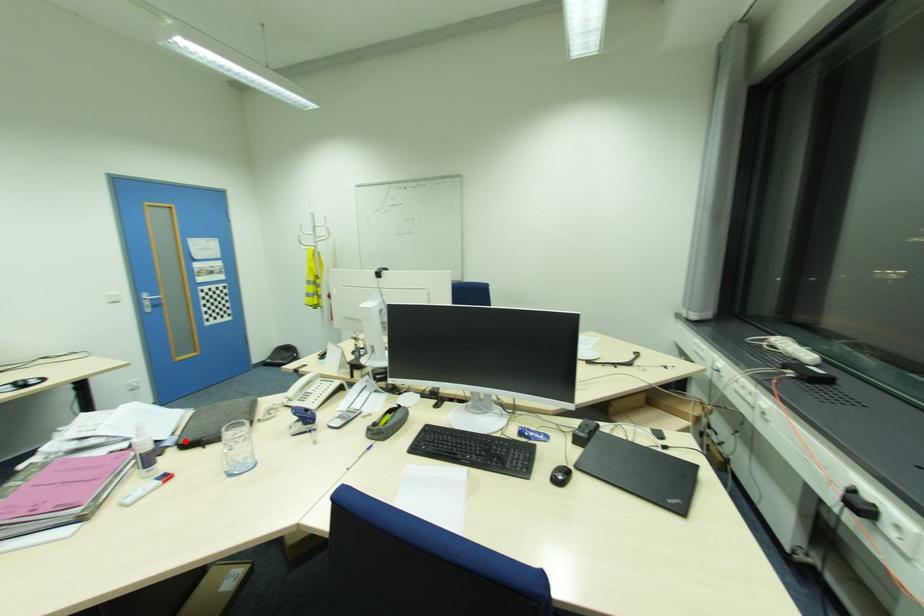
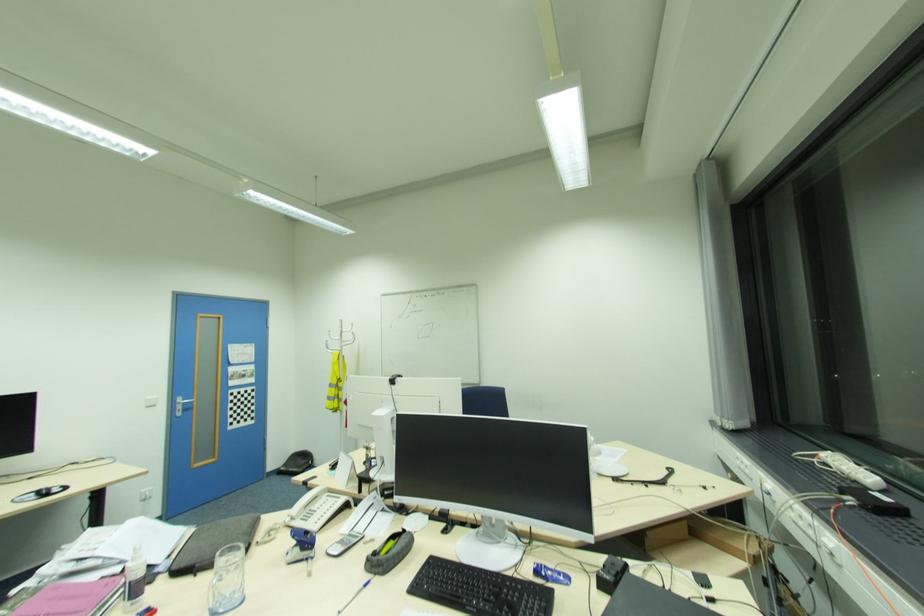
Locate, in the second image, the point that corresponds to the highlighted location in the first image.

(177, 568)